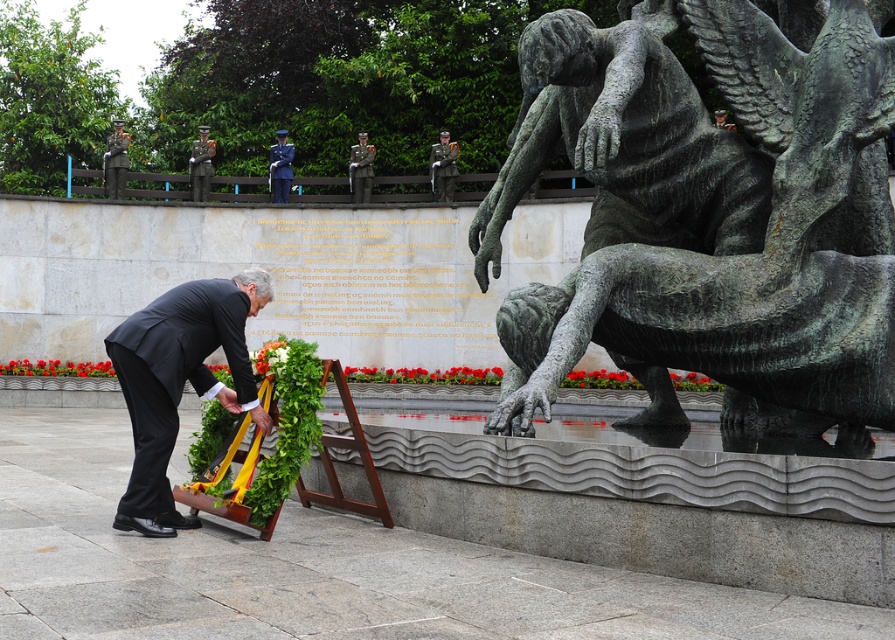
Question: Which is nearer to the shiny blue uniform at center?

Choices:
 (A) green leafy wreath at lower left
 (B) matte bronze statue at upper right
 (C) shiny black uniform at upper center

Answer: (C)

Question: Observing the image, what is the correct spatial positioning of black suit at lower left in reference to shiny black uniform at upper center?

Choices:
 (A) left
 (B) right

Answer: (B)

Question: Can you confirm if green patina bronze statue at center is smaller than shiny black uniform at center?

Choices:
 (A) no
 (B) yes

Answer: (A)

Question: Among these objects, which one is nearest to the camera?

Choices:
 (A) shiny black uniform at center
 (B) green leafy wreath at lower left

Answer: (B)

Question: Which point is farther to the camera?

Choices:
 (A) (193, 196)
 (B) (276, 170)
 (C) (431, 179)

Answer: (B)

Question: Can you confirm if green patina bronze statue at center is positioned to the right of green uniform at center?

Choices:
 (A) no
 (B) yes

Answer: (B)